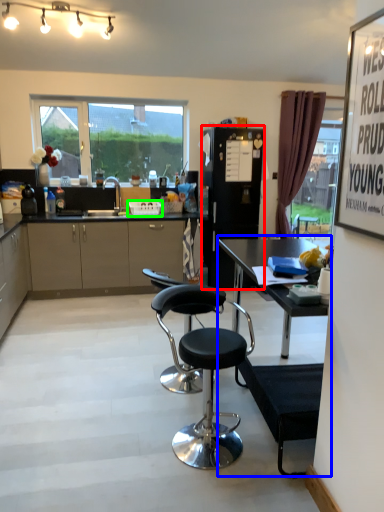
Question: Which is farther away from appliance (highlighted by a red box)? table (highlighted by a blue box) or picnic basket (highlighted by a green box)?

Choices:
 (A) table
 (B) picnic basket

Answer: (A)